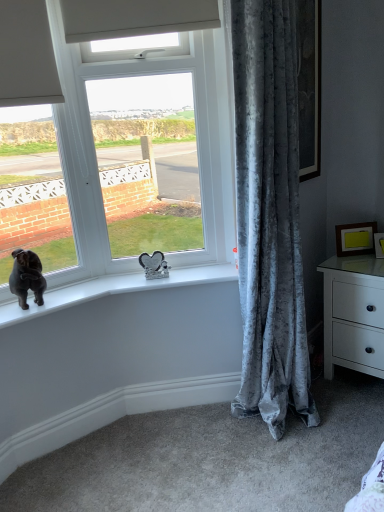
Question: In terms of width, does white plastic window at center look wider or thinner when compared to velvet gray curtain at right?

Choices:
 (A) thin
 (B) wide

Answer: (A)

Question: From the image's perspective, is white plastic window at center above or below velvet gray curtain at right?

Choices:
 (A) below
 (B) above

Answer: (B)

Question: Which object is the closest to the velvet gray curtain at right?

Choices:
 (A) white plastic window at center
 (B) matte gold picture frame at right, which is the second picture frame in left-to-right order
 (C) black velvet dog at window
 (D) white glossy chest of drawers at right
 (E) yellow matte picture frame at upper right, which ranks as the 2th picture frame in right-to-left order

Answer: (A)

Question: Considering the real-world distances, which object is closest to the white glossy chest of drawers at right?

Choices:
 (A) matte gold picture frame at right, the first picture frame from the right
 (B) yellow matte picture frame at upper right, positioned as the 1th picture frame in left-to-right order
 (C) black velvet dog at window
 (D) white plastic window at center
 (E) velvet gray curtain at right

Answer: (B)